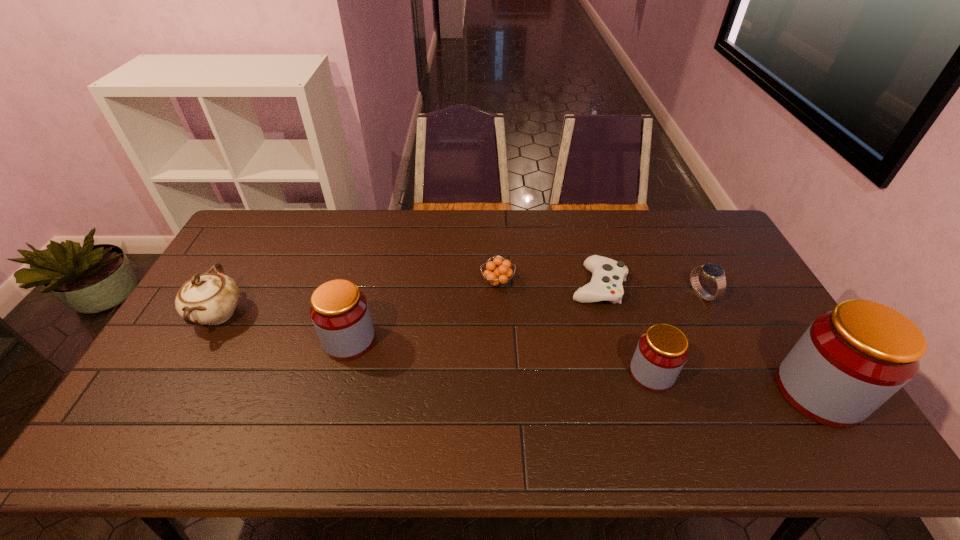
Where is `free space located 0.130m on the left of the leftmost jar`? This screenshot has width=960, height=540. free space located 0.130m on the left of the leftmost jar is located at coordinates (278, 340).

Find the location of a particular element. The width and height of the screenshot is (960, 540). vacant space situated 0.210m on the left of the shortest jar is located at coordinates (551, 374).

At what (x,y) coordinates should I click in order to perform the action: click on vacant area situated on the left of the rightmost object. Please return your answer as a coordinate pair (x, y). Looking at the image, I should click on (709, 392).

At what (x,y) coordinates should I click in order to perform the action: click on free point located on the front of the chinaware. Please return your answer as a coordinate pair (x, y). Looking at the image, I should click on (188, 367).

Where is `vacant space situated 0.220m on the back of the fifth object from right to left`? vacant space situated 0.220m on the back of the fifth object from right to left is located at coordinates (495, 230).

At what (x,y) coordinates should I click in order to perform the action: click on vacant space situated on the right of the control. Please return your answer as a coordinate pair (x, y). Looking at the image, I should click on (752, 286).

Locate an element on the screen. vacant space located 0.370m on the back of the second object from right to left is located at coordinates (661, 214).

The height and width of the screenshot is (540, 960). In order to click on object that is at the left edge in this screenshot , I will do `click(210, 298)`.

What are the coordinates of `jar that is at the right edge` in the screenshot? It's located at 852,359.

The width and height of the screenshot is (960, 540). I want to click on watch at the right edge, so click(x=711, y=271).